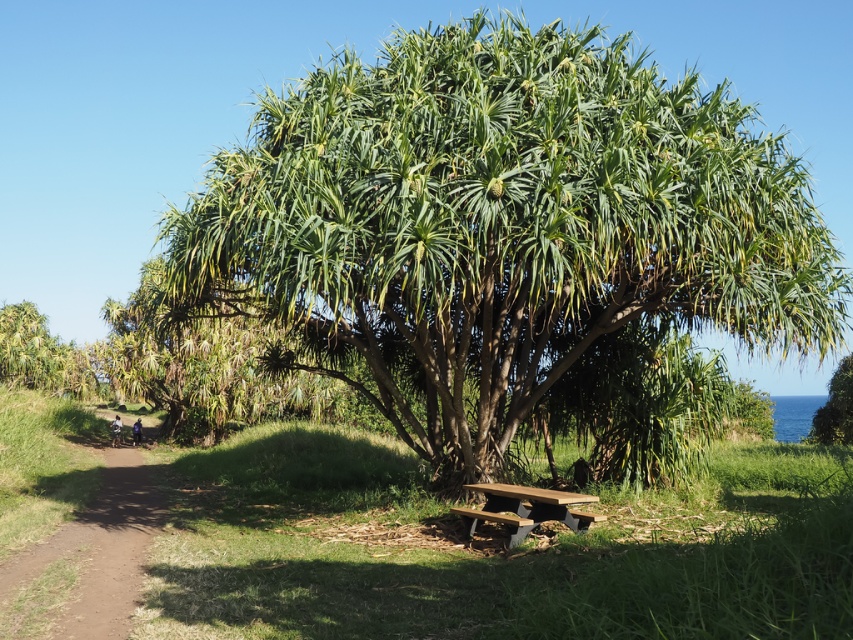
Question: Does brown dirt path at lower left appear over brown wooden picnic table at lower center?

Choices:
 (A) yes
 (B) no

Answer: (B)

Question: Among these points, which one is farthest from the camera?

Choices:
 (A) (556, 516)
 (B) (67, 632)
 (C) (833, 426)
 (D) (421, 140)

Answer: (C)

Question: Which point is farther from the camera taking this photo?

Choices:
 (A) (117, 628)
 (B) (807, 353)
 (C) (476, 515)
 (D) (811, 426)

Answer: (D)

Question: Can you confirm if green leafy tree at center is positioned above brown dirt path at lower left?

Choices:
 (A) yes
 (B) no

Answer: (A)

Question: Can you confirm if brown dirt path at lower left is positioned above brown wooden picnic table at lower center?

Choices:
 (A) yes
 (B) no

Answer: (B)

Question: Considering the real-world distances, which object is farthest from the brown dirt path at lower left?

Choices:
 (A) green leafy tree at right
 (B) brown wooden picnic table at lower center
 (C) green leafy tree at center

Answer: (A)